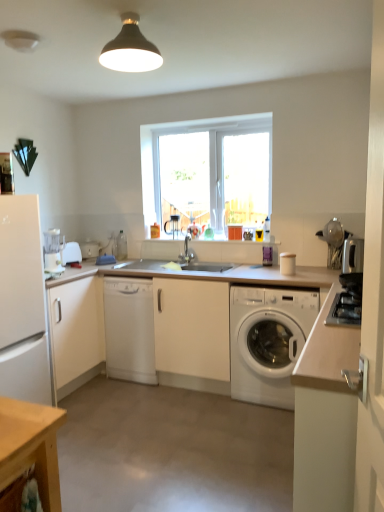
Question: In terms of height, does white matte dishwasher at center look taller or shorter compared to white plastic toaster at left, the third appliance in the right-to-left sequence?

Choices:
 (A) short
 (B) tall

Answer: (B)

Question: Would you say white matte dishwasher at center is to the left or to the right of white plastic toaster at left, placed as the first appliance when sorted from back to front, in the picture?

Choices:
 (A) right
 (B) left

Answer: (A)

Question: Which of these objects is positioned farthest from the white matte refrigerator at left?

Choices:
 (A) white matte cabinet at left, which appears as the first cabinetry when viewed from the back
 (B) white plastic toaster at left, the third appliance in the right-to-left sequence
 (C) matte silver faucet at center
 (D) white matte cabinet at right, which is the 2th cabinetry in back-to-front order
 (E) white plastic toaster at left

Answer: (D)

Question: Considering the real-world distances, which object is closest to the satin silver toaster at right, which ranks as the 1th appliance in front-to-back order?

Choices:
 (A) white plastic toaster at left
 (B) white matte refrigerator at left
 (C) white plastic washing machine at center
 (D) white matte cabinet at left, which is the first cabinetry from left to right
 (E) white matte cabinet at right, the first cabinetry positioned from the right

Answer: (C)